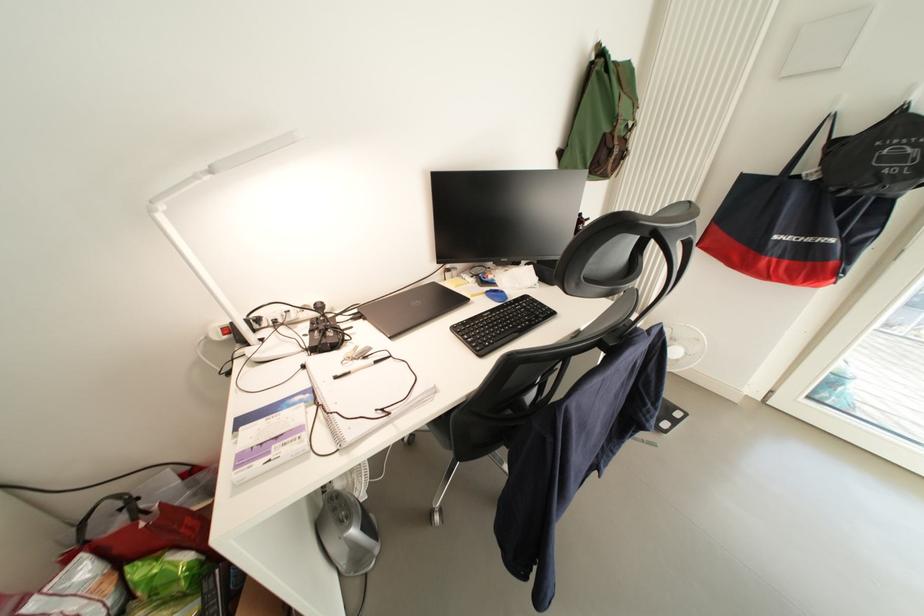
Find where to lift the tote bag handle. Please return your answer as a coordinate pair (x, y).

(805, 146)